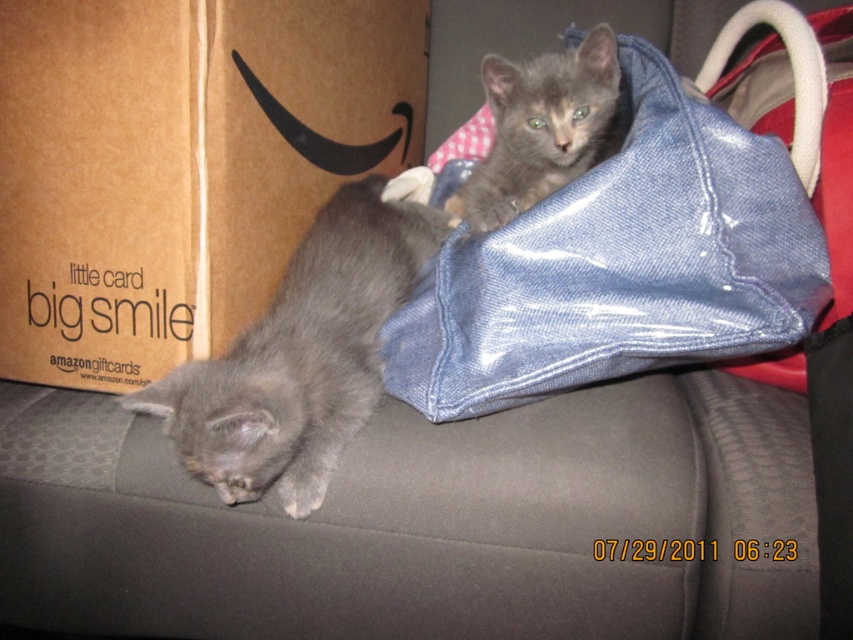
Question: Among these objects, which one is farthest from the camera?

Choices:
 (A) denim bag at upper right
 (B) gray furry kitten at upper right
 (C) gray fur cat at lower left

Answer: (B)

Question: Estimate the real-world distances between objects in this image. Which object is closer to the soft gray kitten at left?

Choices:
 (A) gray furry kitten at upper right
 (B) denim bag at upper right
 (C) gray fur cat at lower left
 (D) cardboard box at left

Answer: (B)

Question: Can you confirm if denim bag at upper right is thinner than gray fur cat at lower left?

Choices:
 (A) yes
 (B) no

Answer: (B)

Question: Which point is farther from the camera taking this photo?

Choices:
 (A) (273, 100)
 (B) (419, 460)

Answer: (A)

Question: Is soft gray kitten at left to the left of denim bag at upper right from the viewer's perspective?

Choices:
 (A) yes
 (B) no

Answer: (A)

Question: Is soft gray kitten at left closer to the viewer compared to gray fur cat at lower left?

Choices:
 (A) yes
 (B) no

Answer: (B)